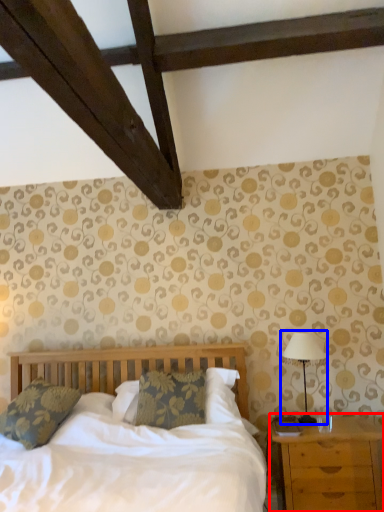
Question: Which of the following is the closest to the observer, nightstand (highlighted by a red box) or table lamp (highlighted by a blue box)?

Choices:
 (A) nightstand
 (B) table lamp

Answer: (A)